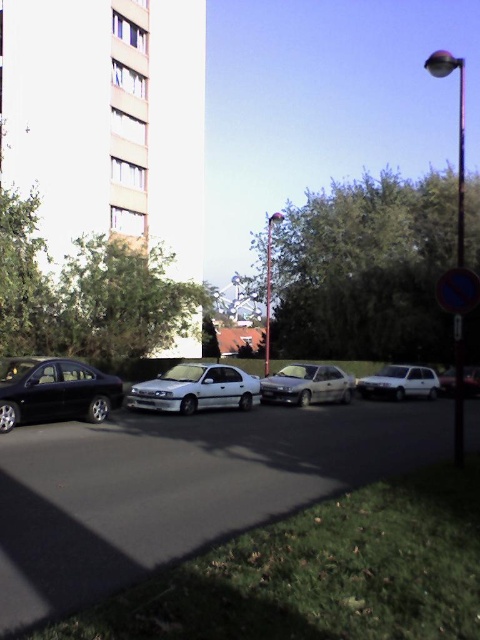
Question: Is black metallic car at center positioned behind white glossy car at center?

Choices:
 (A) no
 (B) yes

Answer: (A)

Question: Is shiny black sedan at left positioned behind white matte hatchback at center?

Choices:
 (A) yes
 (B) no

Answer: (B)

Question: Does black metallic car at center appear on the right side of silver metallic car at center?

Choices:
 (A) no
 (B) yes

Answer: (A)

Question: Which point is farther to the camera?

Choices:
 (A) (396, 380)
 (B) (145, 548)

Answer: (A)

Question: Which object is farther from the camera taking this photo?

Choices:
 (A) white matte car at lower right
 (B) black metallic car at center
 (C) white glossy car at center
 (D) white matte hatchback at center

Answer: (D)

Question: Which point is farther to the camera?

Choices:
 (A) (59, 397)
 (B) (335, 376)
 (C) (468, 369)

Answer: (C)